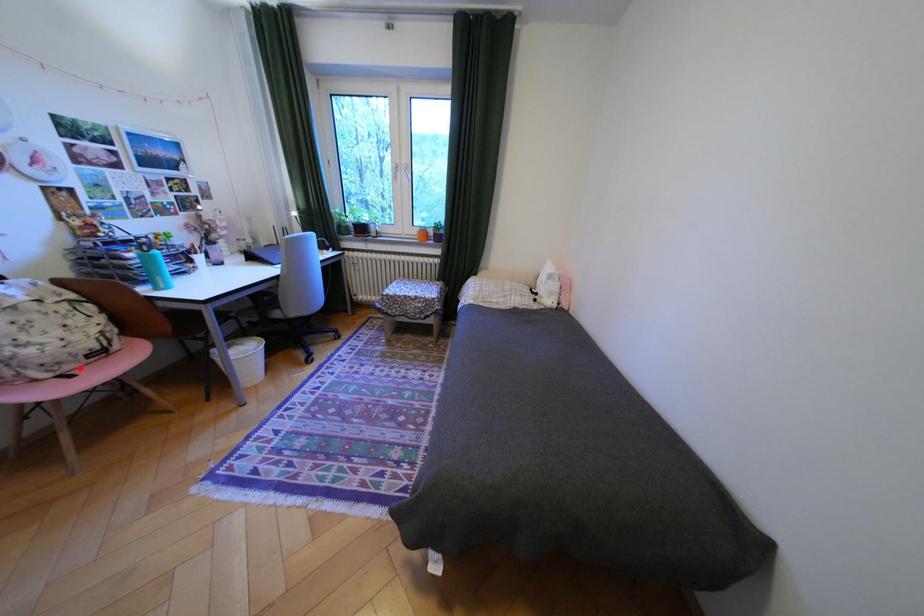
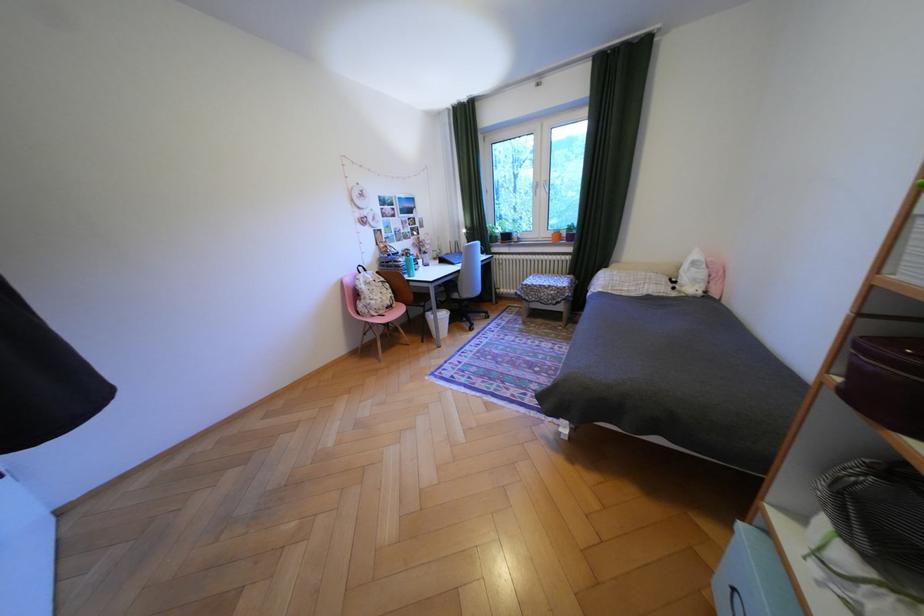
Question: A red point is marked in image1. In image2, is the corresponding 3D point closer to the camera or farther? Reply with the corresponding letter.

Choices:
 (A) The corresponding 3D point is closer.
 (B) The corresponding 3D point is farther.

Answer: (A)